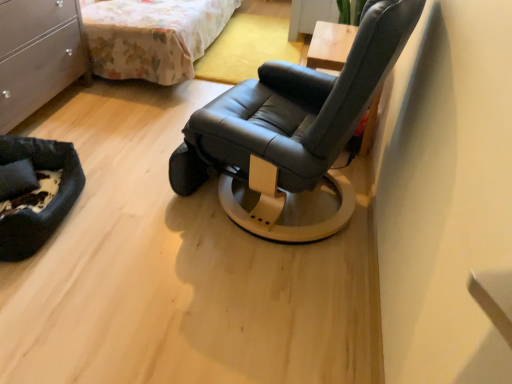
Question: Considering the positions of black fabric pillow at lower left and matte white dresser at left in the image, is black fabric pillow at lower left bigger or smaller than matte white dresser at left?

Choices:
 (A) big
 (B) small

Answer: (B)

Question: Is black fabric pillow at lower left wider or thinner than matte white dresser at left?

Choices:
 (A) wide
 (B) thin

Answer: (B)

Question: Estimate the real-world distances between objects in this image. Which object is farther from the black fabric pet bed at lower left?

Choices:
 (A) floral fabric bed at upper left
 (B) black leather chair at center
 (C) black fabric pillow at lower left
 (D) matte white dresser at left

Answer: (A)

Question: Which object is the farthest from the black fabric pillow at lower left?

Choices:
 (A) floral fabric bed at upper left
 (B) black leather chair at center
 (C) black fabric pet bed at lower left
 (D) matte white dresser at left

Answer: (A)